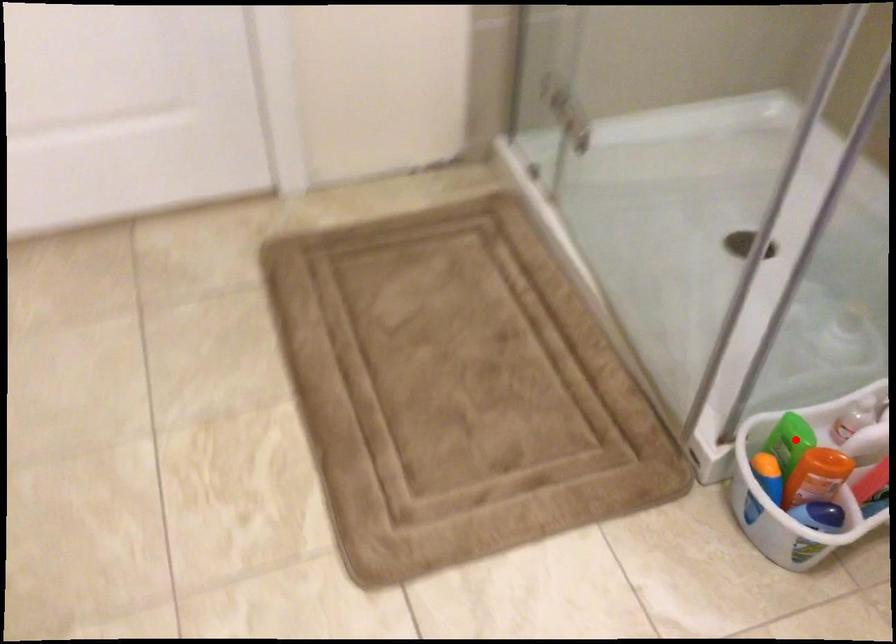
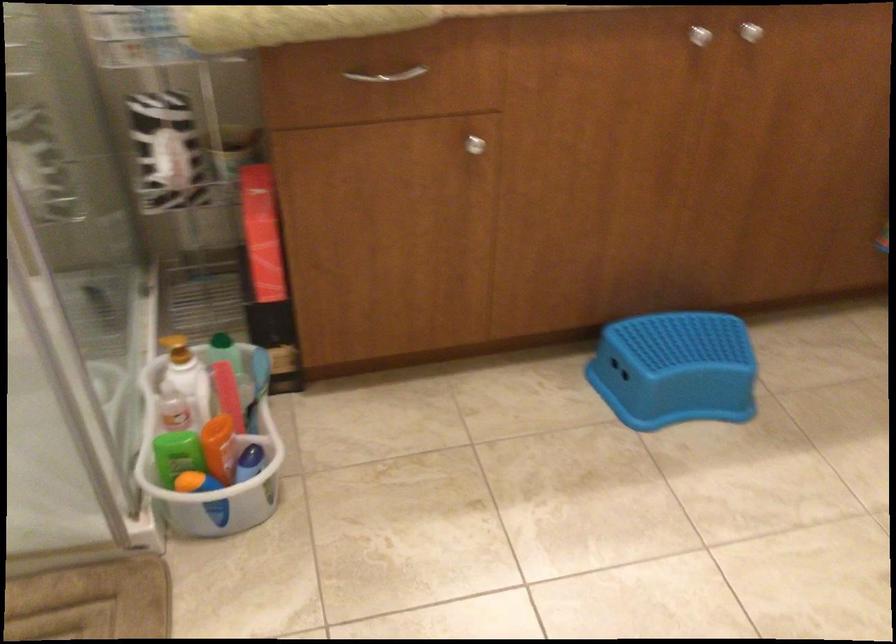
The point at the highlighted location is marked in the first image. Where is the corresponding point in the second image?

(177, 453)